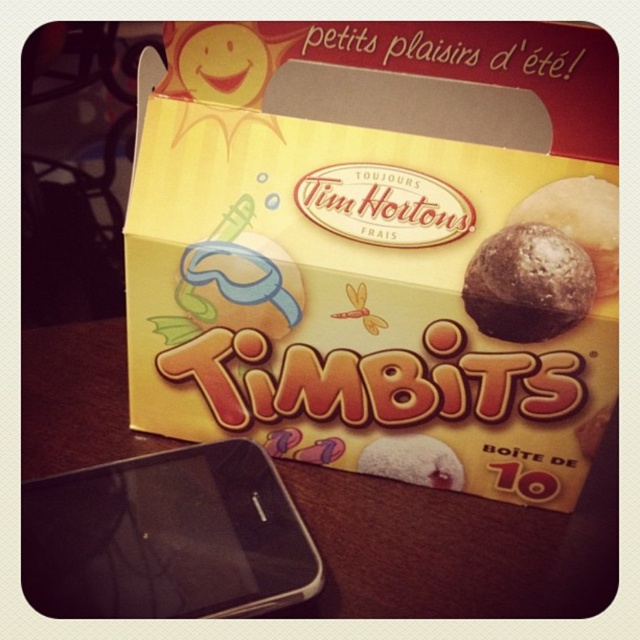
Question: Which point is closer to the camera?

Choices:
 (A) (140, 502)
 (B) (545, 525)
 (C) (566, 413)
 (D) (604, 243)

Answer: (D)

Question: Is wooden table at center to the left of dark chocolate cookie at center from the viewer's perspective?

Choices:
 (A) no
 (B) yes

Answer: (B)

Question: Is wooden table at center smaller than black glossy smartphone at lower left?

Choices:
 (A) yes
 (B) no

Answer: (B)

Question: Which object is the farthest from the chocolate-coated ball at center?

Choices:
 (A) wooden table at center
 (B) black glossy smartphone at lower left
 (C) yellow matte timbits box at center

Answer: (B)

Question: Which object is positioned farthest from the dark chocolate cookie at center?

Choices:
 (A) wooden table at center
 (B) black glossy smartphone at lower left
 (C) yellow matte timbits box at center

Answer: (B)

Question: Does yellow matte timbits box at center appear on the left side of dark chocolate cookie at center?

Choices:
 (A) no
 (B) yes

Answer: (B)